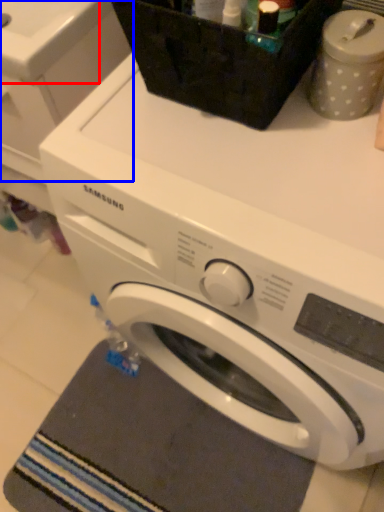
Question: Which point is further to the camera, sink (highlighted by a red box) or washing machine (highlighted by a blue box)?

Choices:
 (A) sink
 (B) washing machine

Answer: (A)